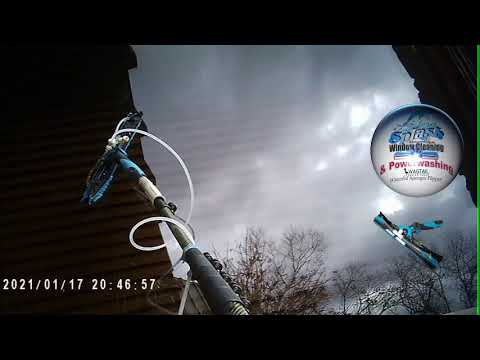
Locate an element on the screen. The height and width of the screenshot is (360, 480). window is located at coordinates (281, 121).